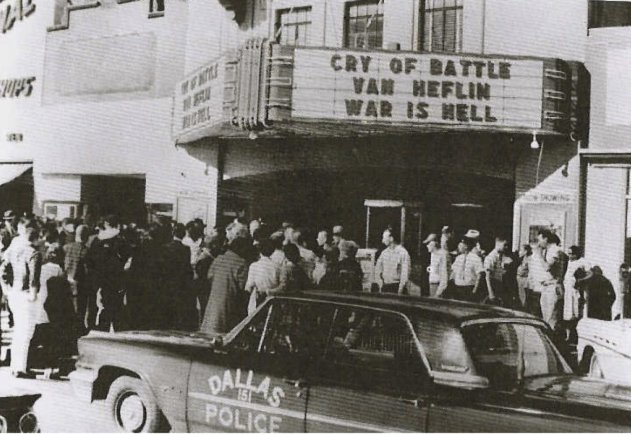
You are a GUI agent. You are given a task and a screenshot of the screen. Output one action in this format:
    pyautogui.click(x=<x>, y=<y>)
    Task: Click on the window
    The height and width of the screenshot is (434, 631).
    Given the screenshot: What is the action you would take?
    point(498,356)